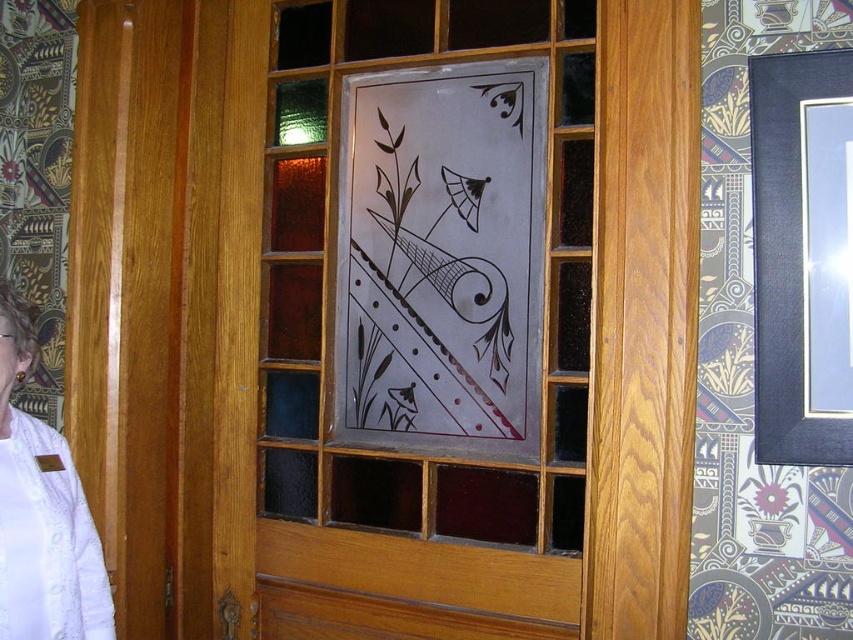
You are a painter standing in front of the transparent glass door at center and the transparent glass artwork at center. You want to paint the artwork without getting paint on the door. Which one should you cover first with a protective sheet?

The transparent glass door at center is positioned under the transparent glass artwork at center, so you should cover the transparent glass artwork at center first to prevent paint from dripping onto the door below.

You are standing in front of the wooden door with the decorative glass panel. You notice the transparent glass artwork at center and the white fabric at left. If you want to place a 30 inch wide painting between them, will there be enough space?

The transparent glass artwork at center and white fabric at left are 29.78 inches apart from each other. Since the painting is 30 inches wide, it will not fit between them as the space is slightly smaller than the painting.